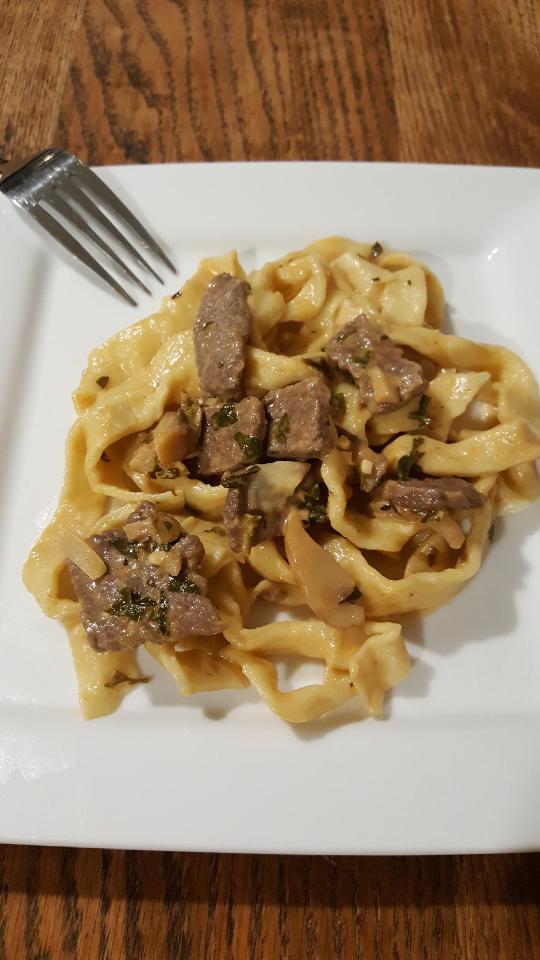
Locate an element on the screen. wood grain is located at coordinates (161, 936).